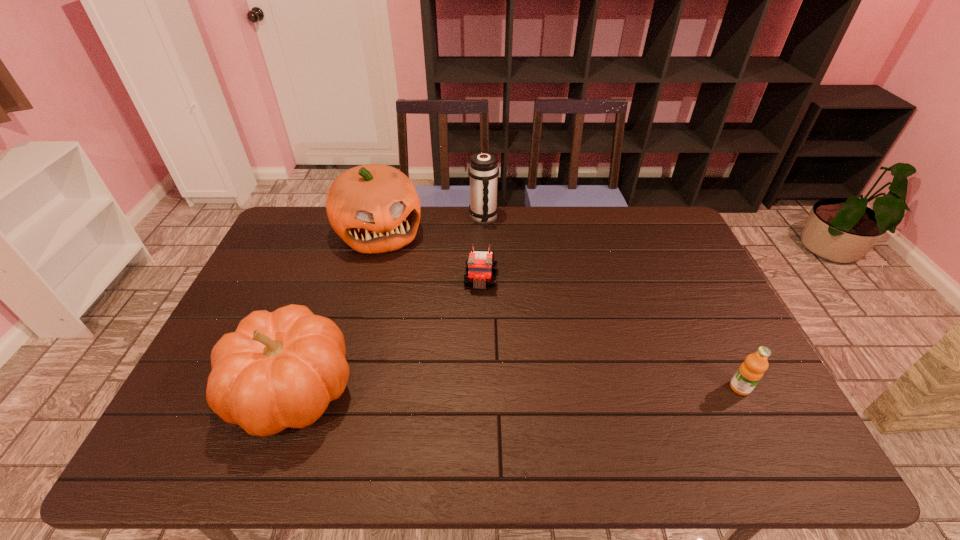
This screenshot has height=540, width=960. What are the coordinates of `orange juice that is at the near edge` in the screenshot? It's located at (750, 372).

Locate an element on the screen. object present at the left edge is located at coordinates [x=280, y=369].

The image size is (960, 540). In order to click on object that is at the right edge in this screenshot , I will do `click(750, 372)`.

At what (x,y) coordinates should I click in order to perform the action: click on object at the near left corner. Please return your answer as a coordinate pair (x, y). This screenshot has height=540, width=960. Looking at the image, I should click on (280, 369).

You are a GUI agent. You are given a task and a screenshot of the screen. Output one action in this format:
    pyautogui.click(x=<x>, y=<y>)
    Task: Click on the object at the near right corner
    
    Given the screenshot: What is the action you would take?
    pyautogui.click(x=750, y=372)

Where is `free space at the far edge of the desktop`? Image resolution: width=960 pixels, height=540 pixels. free space at the far edge of the desktop is located at coordinates (570, 242).

The width and height of the screenshot is (960, 540). I want to click on free space at the near edge, so click(540, 393).

The width and height of the screenshot is (960, 540). What are the coordinates of `free space at the right edge of the desktop` in the screenshot? It's located at (711, 325).

The image size is (960, 540). In the image, there is a desktop. What are the coordinates of `free space at the far left corner` in the screenshot? It's located at (304, 225).

In order to click on unoccupied position between the farther pumpkin and the shortest object in this screenshot , I will do `click(430, 256)`.